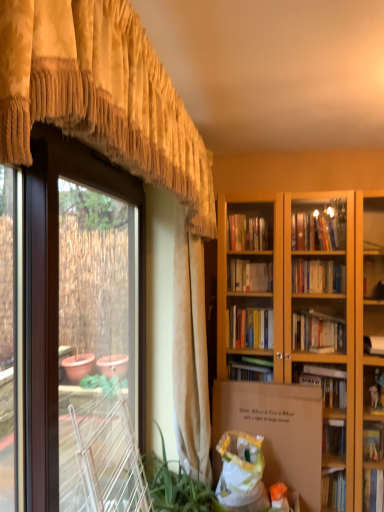
Question: Considering the relative sizes of gold textured valance at upper left, the 1th curtain in the front-to-back sequence, and white cardboard box at center in the image provided, is gold textured valance at upper left, the 1th curtain in the front-to-back sequence, smaller than white cardboard box at center?

Choices:
 (A) no
 (B) yes

Answer: (A)

Question: Considering the relative positions of gold textured valance at upper left, the 1th curtain in the front-to-back sequence, and white cardboard box at center in the image provided, is gold textured valance at upper left, the 1th curtain in the front-to-back sequence, to the right of white cardboard box at center from the viewer's perspective?

Choices:
 (A) no
 (B) yes

Answer: (A)

Question: Can you confirm if gold textured valance at upper left, the 1th curtain in the front-to-back sequence, is shorter than white cardboard box at center?

Choices:
 (A) no
 (B) yes

Answer: (B)

Question: Is gold textured valance at upper left, the 1th curtain in the front-to-back sequence, thinner than white cardboard box at center?

Choices:
 (A) no
 (B) yes

Answer: (A)

Question: Is gold textured valance at upper left, arranged as the 2th curtain when viewed from the back, in front of white cardboard box at center?

Choices:
 (A) yes
 (B) no

Answer: (A)

Question: Considering the positions of point (178, 463) and point (26, 502), is point (178, 463) closer or farther from the camera than point (26, 502)?

Choices:
 (A) closer
 (B) farther

Answer: (B)

Question: Visually, is green leafy plant at lower left positioned to the left or to the right of brown matte screen door at left?

Choices:
 (A) right
 (B) left

Answer: (A)

Question: Is green leafy plant at lower left in front of or behind brown matte screen door at left in the image?

Choices:
 (A) front
 (B) behind

Answer: (B)

Question: From a real-world perspective, is green leafy plant at lower left physically located above or below brown matte screen door at left?

Choices:
 (A) below
 (B) above

Answer: (A)

Question: In terms of size, does white plastic bag at lower center appear bigger or smaller than green leafy plant at lower left?

Choices:
 (A) small
 (B) big

Answer: (A)

Question: From a real-world perspective, relative to green leafy plant at lower left, is white plastic bag at lower center vertically above or below?

Choices:
 (A) below
 (B) above

Answer: (A)

Question: Is white plastic bag at lower center to the left or to the right of green leafy plant at lower left in the image?

Choices:
 (A) right
 (B) left

Answer: (A)

Question: Is point (235, 496) positioned closer to the camera than point (168, 501)?

Choices:
 (A) farther
 (B) closer

Answer: (A)

Question: Is gold textured valance at center, which is counted as the second curtain, starting from the front, bigger or smaller than white cardboard box at center?

Choices:
 (A) big
 (B) small

Answer: (A)

Question: From the image's perspective, is gold textured valance at center, which is counted as the second curtain, starting from the front, located above or below white cardboard box at center?

Choices:
 (A) above
 (B) below

Answer: (A)